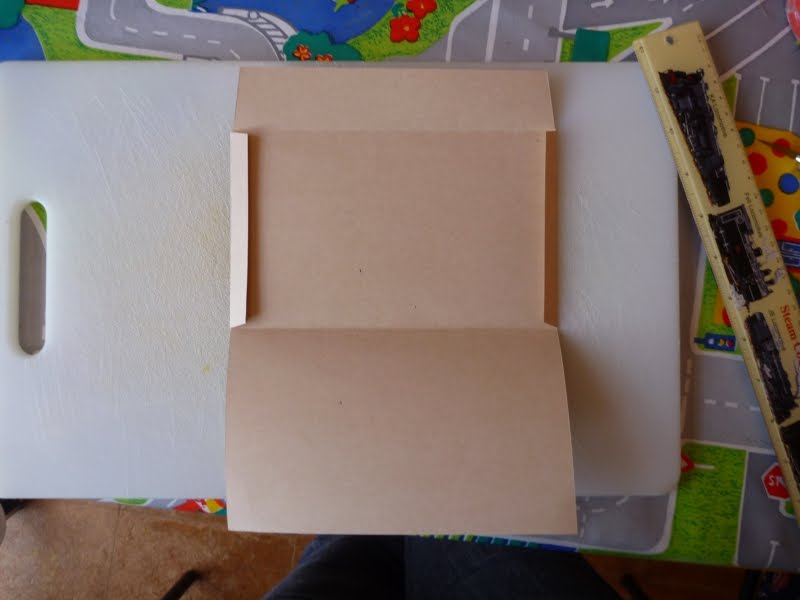
This screenshot has height=600, width=800. Find the location of `rug`. rug is located at coordinates (108, 558).